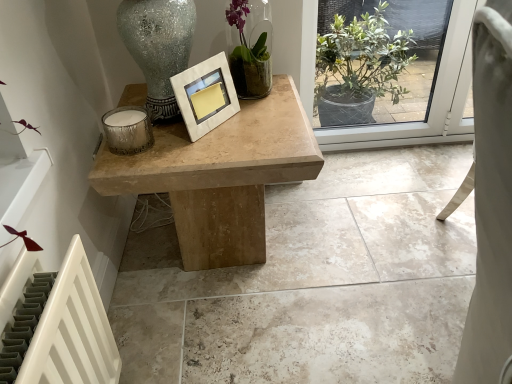
Where is `blank space above natural wood table at center (from a real-world perspective)`? blank space above natural wood table at center (from a real-world perspective) is located at coordinates (219, 123).